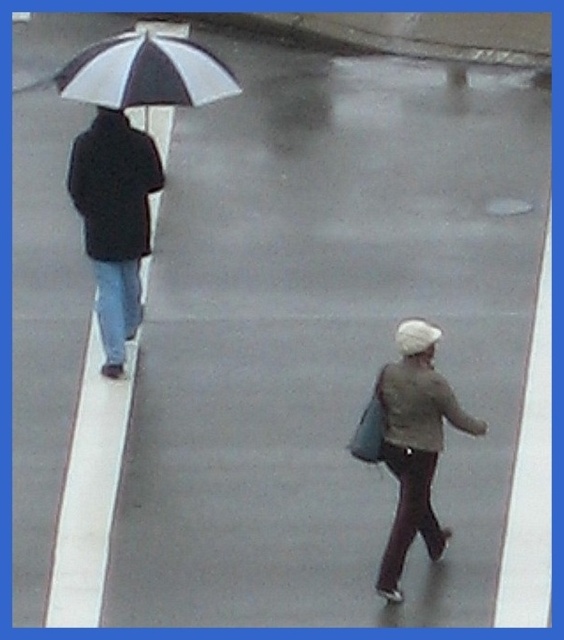
Question: Does light brown fabric jacket at lower right have a lesser width compared to white and black striped umbrella at upper left?

Choices:
 (A) yes
 (B) no

Answer: (A)

Question: Is light brown fabric jacket at lower right thinner than white and black striped umbrella at upper left?

Choices:
 (A) yes
 (B) no

Answer: (A)

Question: Which point is farther to the camera?

Choices:
 (A) (61, 84)
 (B) (390, 582)

Answer: (A)

Question: Can you confirm if light brown fabric jacket at lower right is wider than white and black striped umbrella at upper left?

Choices:
 (A) yes
 (B) no

Answer: (B)

Question: Which of the following is the closest to the observer?

Choices:
 (A) light brown fabric jacket at lower right
 (B) white and black striped umbrella at upper left

Answer: (A)